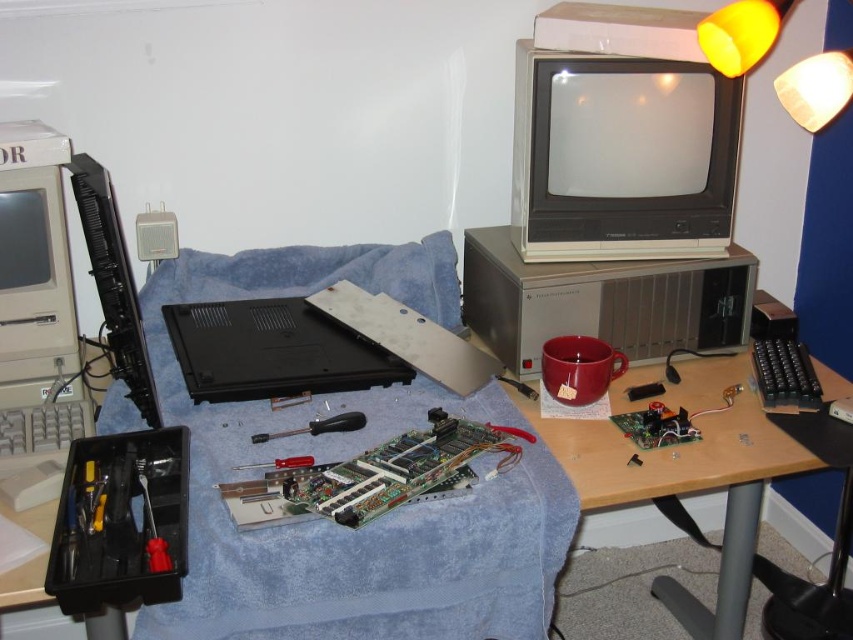
Is black plastic laptop at center bigger than screwdriver at center?

Yes, black plastic laptop at center is bigger than screwdriver at center.

Is black plastic laptop at center positioned in front of screwdriver at center?

Yes, black plastic laptop at center is in front of screwdriver at center.

Locate an element on the screen. black plastic laptop at center is located at coordinates (271, 349).

Can you confirm if gray plastic keyboard at lower left is thinner than satin black screwdriver at center?

Correct, gray plastic keyboard at lower left's width is less than satin black screwdriver at center's.

Can you confirm if gray plastic keyboard at lower left is wider than satin black screwdriver at center?

No.

Is point (4, 454) positioned in front of point (329, 422)?

Yes, point (4, 454) is closer to viewer.

The height and width of the screenshot is (640, 853). I want to click on gray plastic keyboard at lower left, so click(x=41, y=429).

Does point (471, 323) come in front of point (270, 397)?

That is False.

Is metallic gray desktop computer at center below screwdriver at center?

Actually, metallic gray desktop computer at center is above screwdriver at center.

In order to click on metallic gray desktop computer at center in this screenshot , I will do (x=602, y=301).